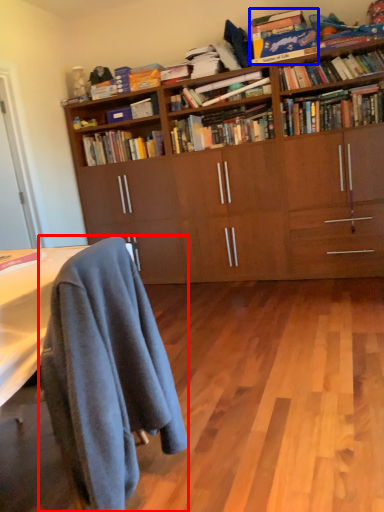
Question: Which object appears closest to the camera in this image, chair (highlighted by a red box) or book (highlighted by a blue box)?

Choices:
 (A) chair
 (B) book

Answer: (A)